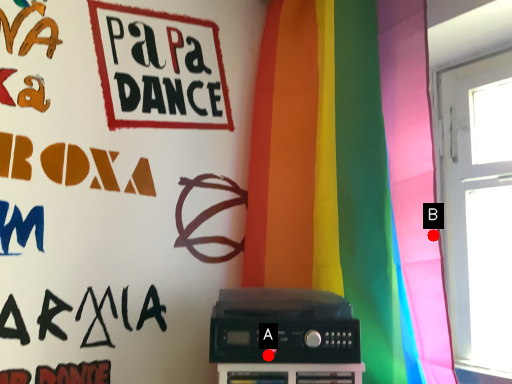
Question: Two points are circled on the image, labeled by A and B beside each circle. Which point is farther to the camera?

Choices:
 (A) A is further
 (B) B is further

Answer: (A)